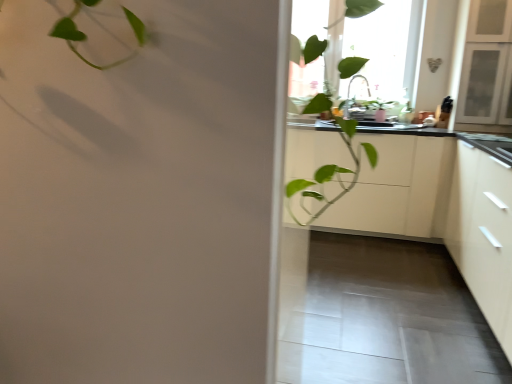
Question: Is transparent glass window at upper center bigger or smaller than black matte countertop at center?

Choices:
 (A) big
 (B) small

Answer: (B)

Question: Is transparent glass window at upper center in front of or behind black matte countertop at center in the image?

Choices:
 (A) front
 (B) behind

Answer: (B)

Question: Estimate the real-world distances between objects in this image. Which object is farther from the black matte countertop at center?

Choices:
 (A) white matte cabinet at right, the 1th cabinetry in the front-to-back sequence
 (B) white matte cabinet at center, the 2th cabinetry when ordered from front to back
 (C) transparent glass window at upper center

Answer: (C)

Question: Based on their relative distances, which object is farther from the white matte cabinet at right, the 1th cabinetry in the front-to-back sequence?

Choices:
 (A) transparent glass window at upper center
 (B) black matte countertop at center
 (C) white matte cabinet at center, the first cabinetry in the back-to-front sequence

Answer: (A)